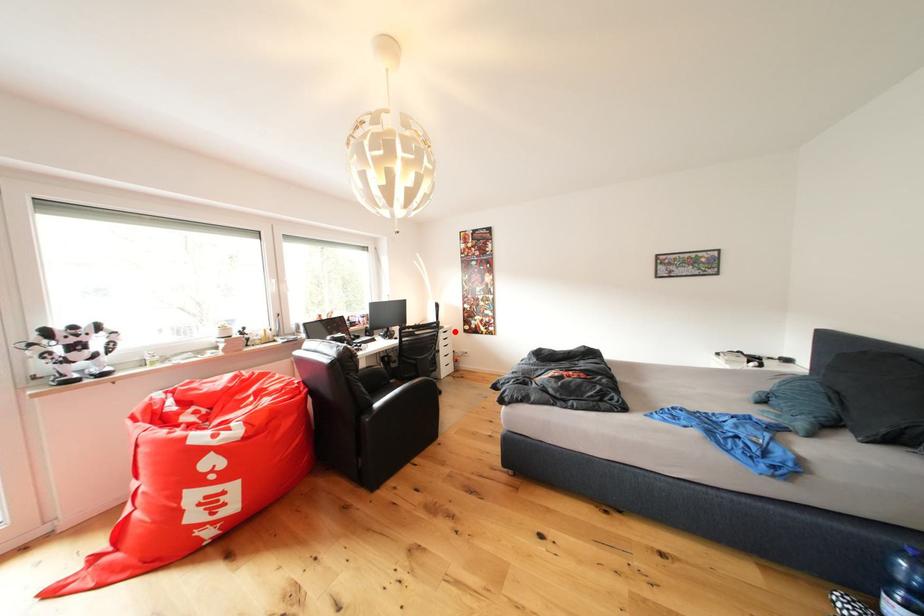
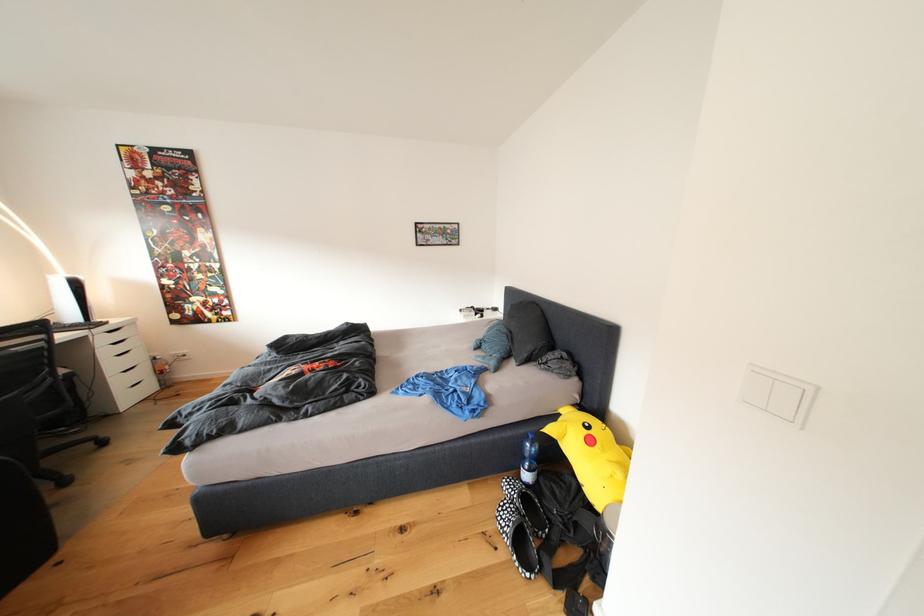
Locate, in the second image, the point that corresponds to the highlighted location in the first image.

(125, 326)